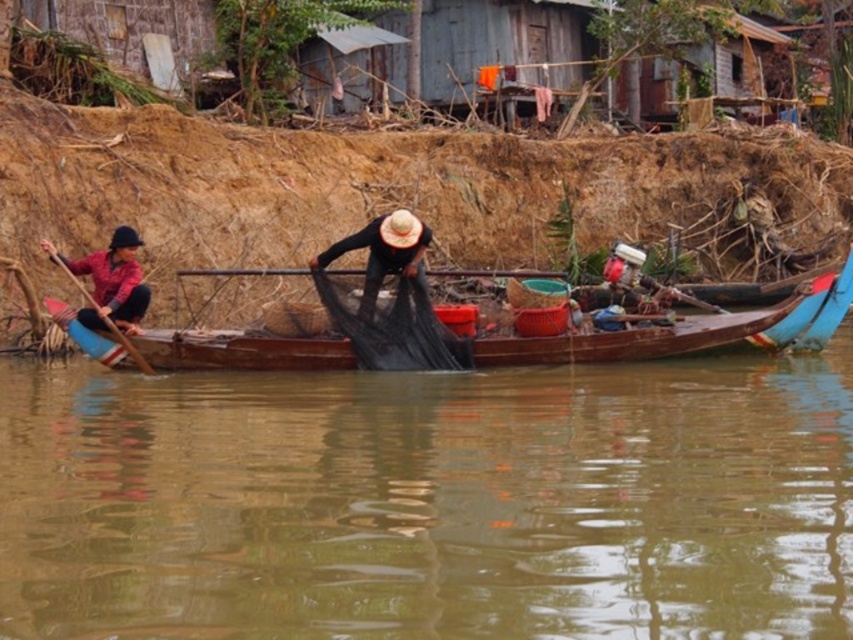
You are standing on the riverbank and see the brown matte water at center and the dark brown woven hat at center. Which object is located lower in the scene?

The brown matte water at center is located lower than the dark brown woven hat at center.

You are a visitor to this riverside village and want to use the black mesh net at center and wooden paddle at left to catch fish. Which tool is wider when looking from above?

The black mesh net at center is wider than the wooden paddle at left.